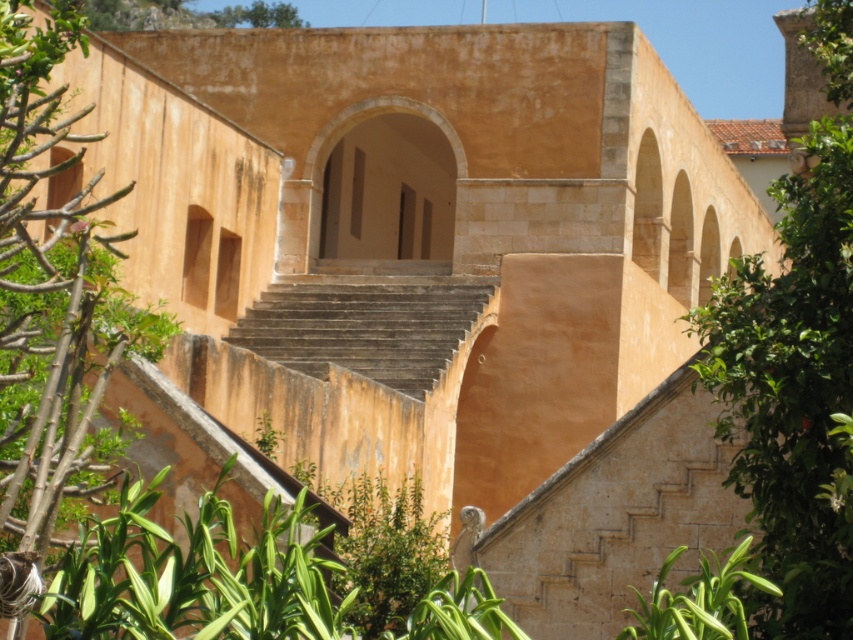
Is green leafy tree at left smaller than beige stone archway at center?

No, green leafy tree at left is not smaller than beige stone archway at center.

Between green leafy tree at left and beige stone archway at center, which one is positioned higher?

beige stone archway at center is higher up.

In order to click on green leafy tree at left in this screenshot , I will do `click(50, 305)`.

I want to click on beige stone archway at center, so click(384, 186).

Which of these two, beige stone archway at center or green leafy plant at lower right, stands shorter?

green leafy plant at lower right

What do you see at coordinates (384, 186) in the screenshot?
I see `beige stone archway at center` at bounding box center [384, 186].

Locate an element on the screen. beige stone archway at center is located at coordinates [x=384, y=186].

Which of these two, green leafy tree at right or brown stone stairs at center, stands taller?

green leafy tree at right

In the scene shown: Who is positioned more to the right, green leafy tree at right or brown stone stairs at center?

From the viewer's perspective, green leafy tree at right appears more on the right side.

Which is in front, point (790, 596) or point (315, 362)?

Point (790, 596) is in front.

Find the location of a particular element. green leafy tree at right is located at coordinates (793, 392).